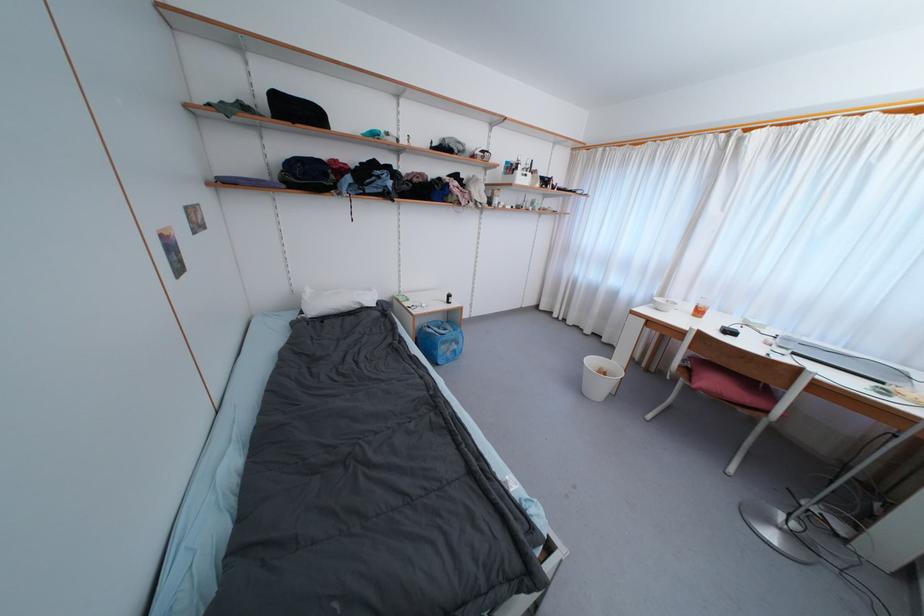
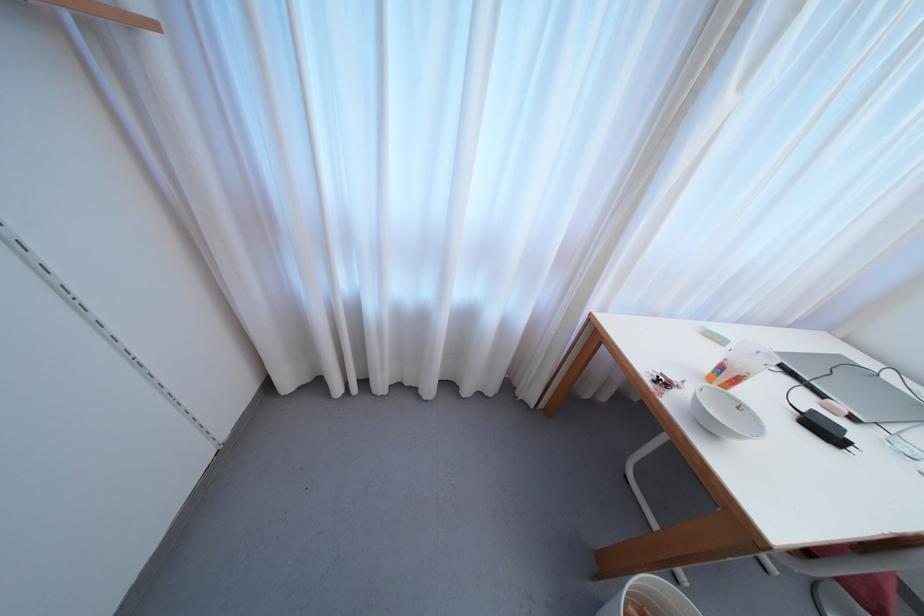
The point at (558, 318) is marked in the first image. Where is the corresponding point in the second image?

(342, 392)